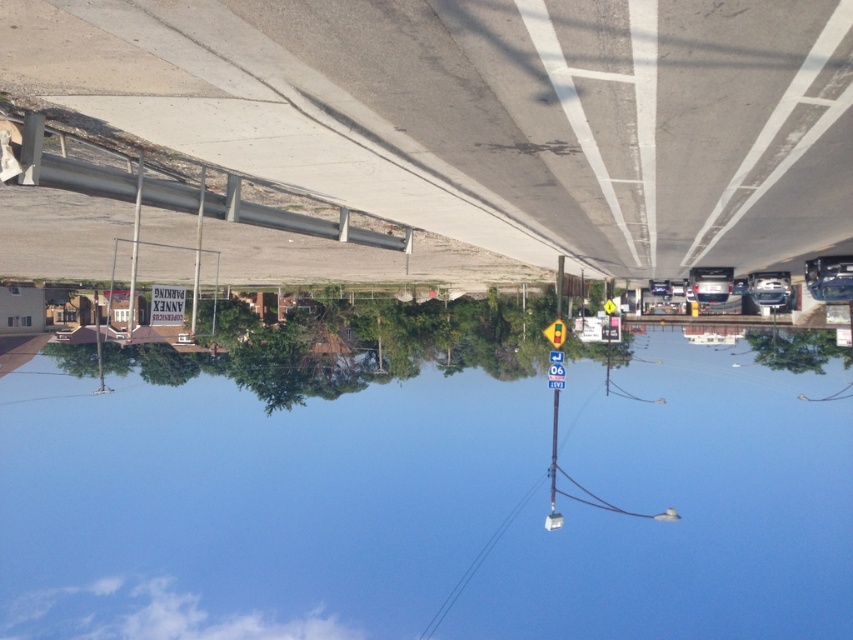
Is concrete overpass at center to the left of satin silver sedan at center from the viewer's perspective?

Yes, concrete overpass at center is to the left of satin silver sedan at center.

Does concrete overpass at center have a larger size compared to satin silver sedan at center?

Yes, concrete overpass at center is bigger than satin silver sedan at center.

Is point (433, 124) farther from camera compared to point (752, 273)?

No, (433, 124) is in front of (752, 273).

Find the location of a particular element. The width and height of the screenshot is (853, 640). concrete overpass at center is located at coordinates (488, 113).

You are a GUI agent. You are given a task and a screenshot of the screen. Output one action in this format:
    pyautogui.click(x=<x>, y=<y>)
    Task: Click on the transparent glass water at center
    
    Given the screenshot: What is the action you would take?
    pyautogui.click(x=428, y=496)

Does transparent glass water at center have a larger size compared to silver metallic sedan at center?

Indeed, transparent glass water at center has a larger size compared to silver metallic sedan at center.

Is point (15, 602) positioned behind point (698, 284)?

That is True.

This screenshot has width=853, height=640. Find the location of `transparent glass water at center`. transparent glass water at center is located at coordinates (428, 496).

Is point (811, 275) farther from camera compared to point (773, 292)?

No.

Between point (833, 296) and point (776, 289), which one is positioned in front?

Point (833, 296) is more forward.

Is point (839, 275) farther from camera compared to point (776, 285)?

No, it is not.

In order to click on metallic silver car at right in this screenshot , I will do `click(828, 276)`.